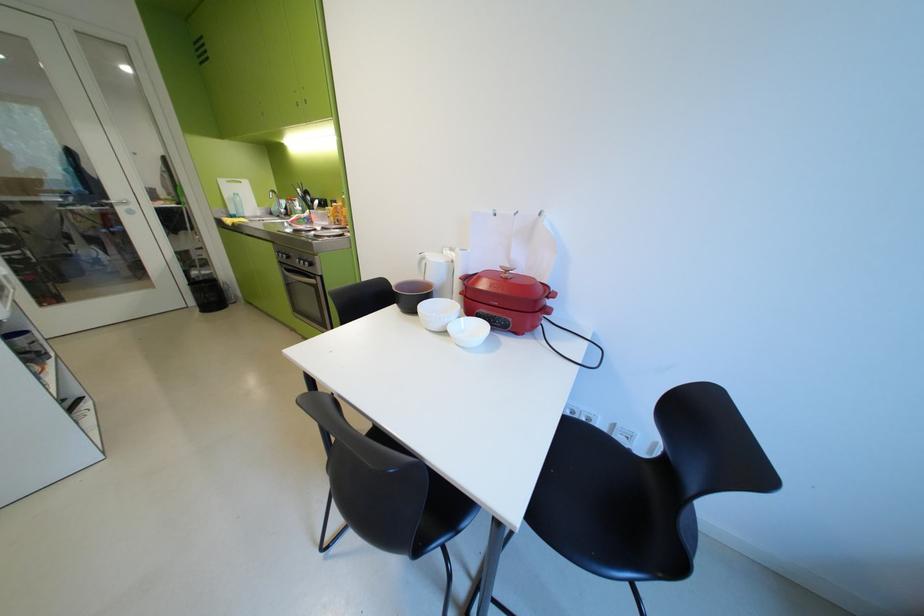
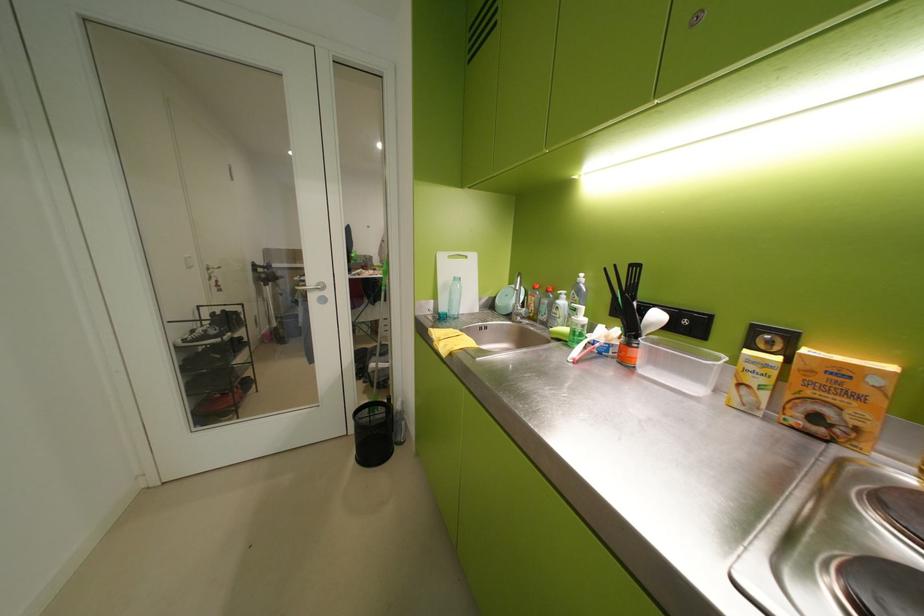
Find the pixel in the second image that matches point 320,199 in the first image.

(646, 304)